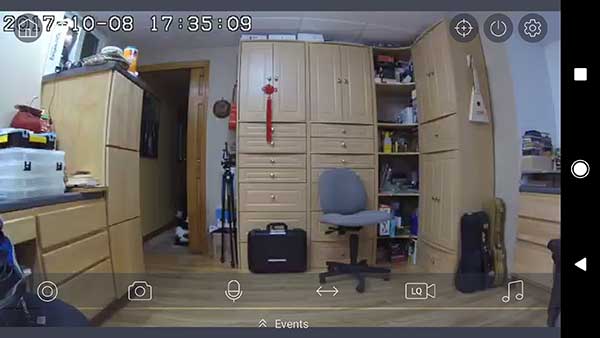
Image resolution: width=600 pixels, height=338 pixels. Find the location of `cabinet drawers`. cabinet drawers is located at coordinates (277, 139), (350, 135), (256, 173), (272, 157), (441, 124).